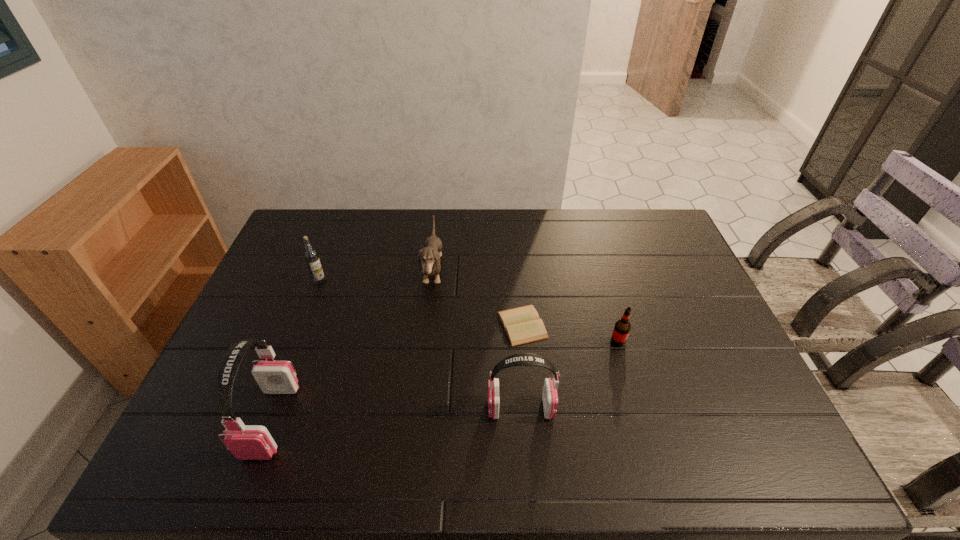
Where is `the left earphone`? The image size is (960, 540). the left earphone is located at coordinates (246, 442).

Find the location of a particular element. The width and height of the screenshot is (960, 540). the taller earphone is located at coordinates (246, 442).

At what (x,y) coordinates should I click in order to perform the action: click on the right earphone. Please return your answer as a coordinate pair (x, y). Looking at the image, I should click on (549, 395).

Where is `puppy`? This screenshot has height=540, width=960. puppy is located at coordinates (430, 255).

What are the coordinates of `root beer` in the screenshot? It's located at (622, 327).

Find the location of a particular element. diary is located at coordinates tap(522, 324).

You are a GUI agent. You are given a task and a screenshot of the screen. Output one action in this format:
    pyautogui.click(x=<x>, y=<y>)
    Task: Click on the vodka
    The image size is (960, 540).
    Given the screenshot: What is the action you would take?
    pyautogui.click(x=311, y=256)

Find the location of a particular element. free space located on the outer surface of the right earphone is located at coordinates (378, 408).

Find the location of a particular element. Image resolution: width=960 pixels, height=540 pixels. vacant space situated 0.360m on the outer surface of the right earphone is located at coordinates (342, 408).

The height and width of the screenshot is (540, 960). Identify the location of vacant space located 0.330m on the outer surface of the right earphone. (354, 408).